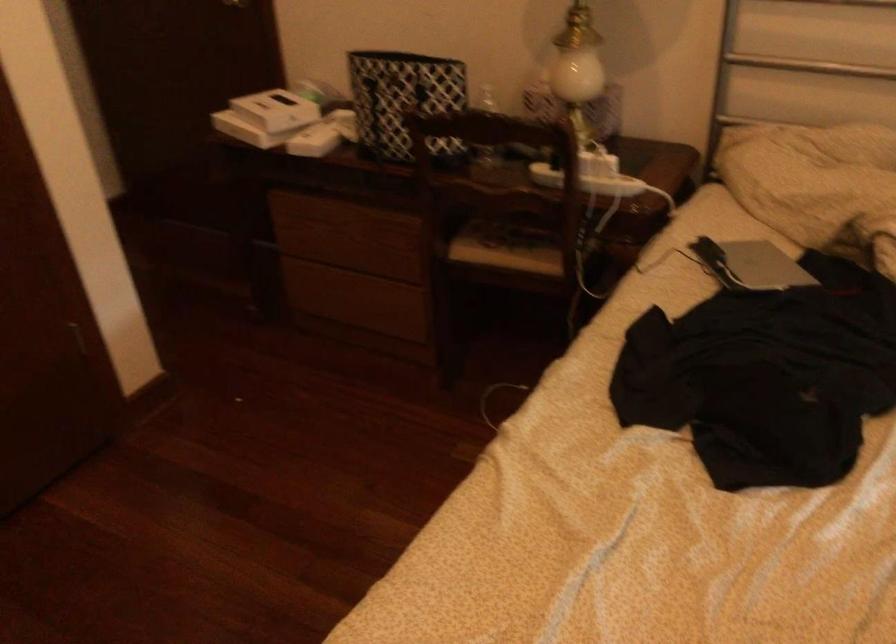
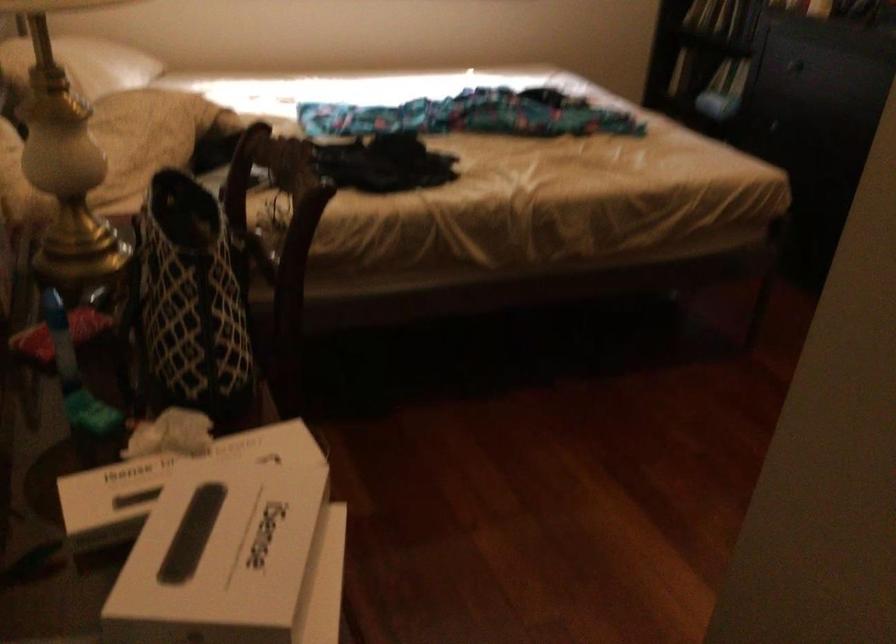
Locate, in the second image, the point that corresponds to [356,77] in the first image.

(188, 301)